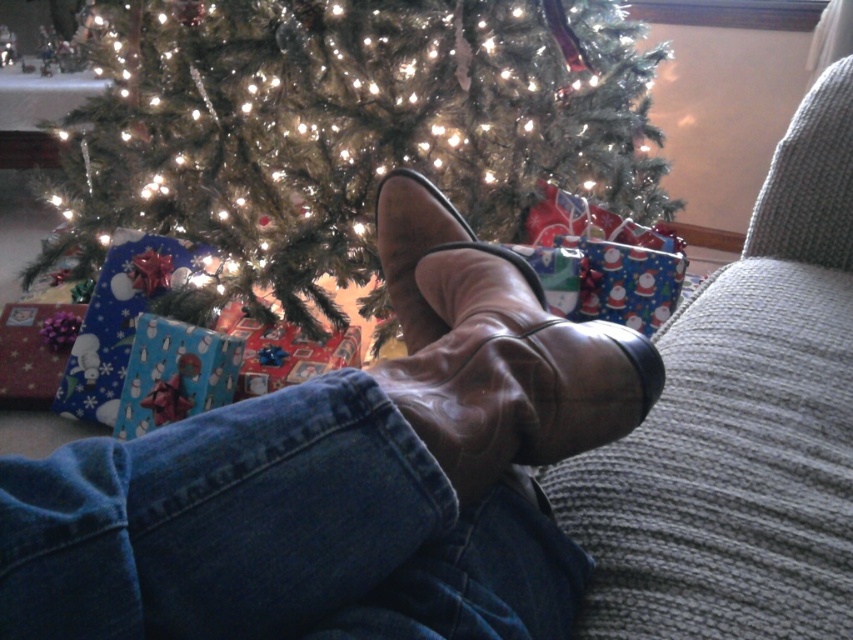
Who is lower down, leather shoe at lower center or green matte christmas tree at center?

Positioned lower is leather shoe at lower center.

Is point (430, 301) farther from camera compared to point (248, 301)?

No, it is in front of (248, 301).

What are the coordinates of `leather shoe at lower center` in the screenshot? It's located at (344, 476).